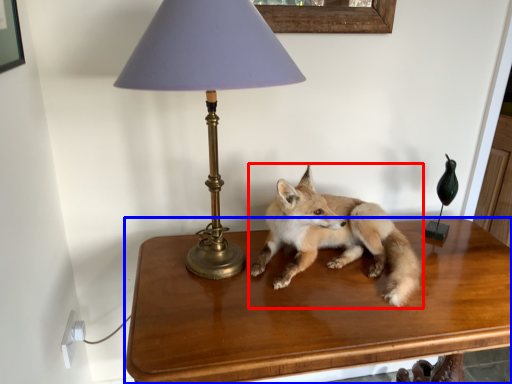
Question: Which of the following is the farthest to the observer, fox (highlighted by a red box) or table (highlighted by a blue box)?

Choices:
 (A) fox
 (B) table

Answer: (A)